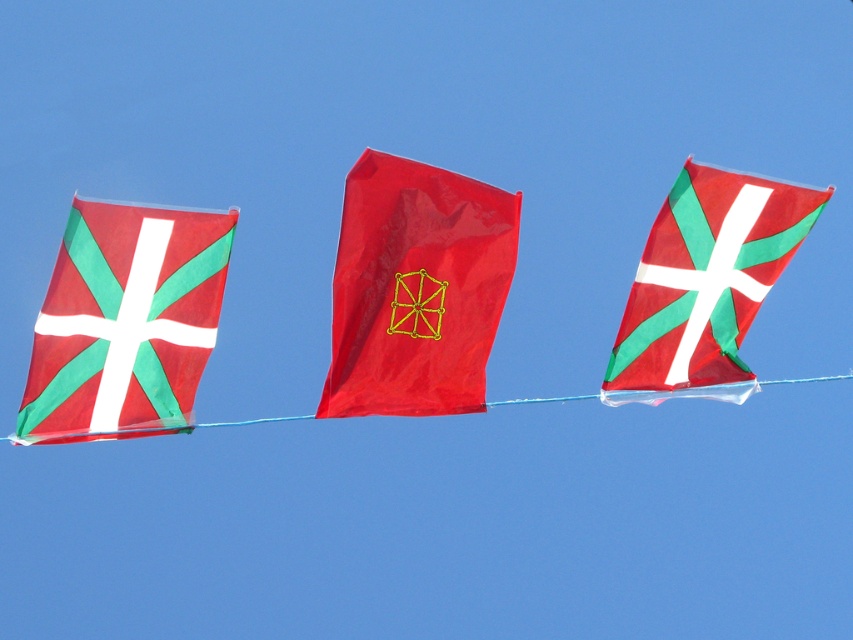
You are standing in front of three flags hanging against a clear blue sky. The flags are attached to a horizontal string stretching across the frame. You see a point at coordinates (416, 289). Which flag is this point located on?

The point at coordinates (416, 289) is located on the shiny red flag at center.

In the scene shown: You are standing in front of two red flags hanging on a string against a blue sky. The shiny red flag at center and the matte red flag at center are both present. Which flag is positioned to the left?

The shiny red flag at center is to the left of the matte red flag at center.

You are a photographer trying to capture the matte fabric flag at left and the matte red flag at center. Since the flags are hanging on the same string, which flag will appear closer to the camera in the photo?

The matte fabric flag at left is in front of the matte red flag at center, so it will appear closer to the camera in the photo.